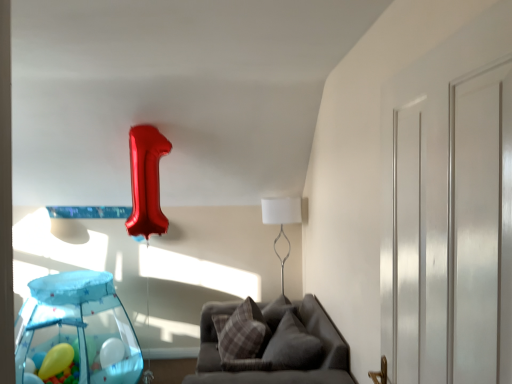
Question: From their relative heights in the image, would you say white metallic table lamp at center is taller or shorter than white glossy door at right?

Choices:
 (A) short
 (B) tall

Answer: (A)

Question: Which is correct: white metallic table lamp at center is inside white glossy door at right, or outside of it?

Choices:
 (A) outside
 (B) inside

Answer: (A)

Question: Which object is the closest to the plush gray pillow at center, acting as the first pillow starting from the right?

Choices:
 (A) yellow rubber balloon at lower left
 (B) translucent blue playpen at lower left
 (C) gray fabric couch at lower center
 (D) white glossy door at right
 (E) white metallic table lamp at center

Answer: (C)

Question: Estimate the real-world distances between objects in this image. Which object is closer to the plaid fabric pillow at center, the 1th pillow from the left?

Choices:
 (A) gray fabric couch at lower center
 (B) yellow rubber balloon at lower left
 (C) translucent blue playpen at lower left
 (D) white glossy door at right
 (E) plush gray pillow at center, acting as the first pillow starting from the right

Answer: (E)